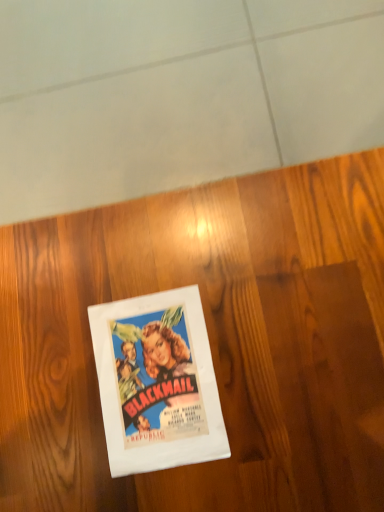
Where is `wooden at center`? wooden at center is located at coordinates (209, 340).

Describe the element at coordinates (209, 340) in the screenshot. I see `wooden at center` at that location.

This screenshot has height=512, width=384. What do you see at coordinates (157, 382) in the screenshot?
I see `white paper at center` at bounding box center [157, 382].

Identify the location of white paper at center. click(x=157, y=382).

I want to click on wooden at center, so click(x=209, y=340).

Which is more to the right, wooden at center or white paper at center?

Positioned to the right is wooden at center.

Which object is closer to the camera taking this photo, wooden at center or white paper at center?

wooden at center.

Which is behind, point (10, 501) or point (154, 455)?

Positioned behind is point (10, 501).

From the image's perspective, is wooden at center positioned above or below white paper at center?

Based on their image positions, wooden at center is located above white paper at center.

From a real-world perspective, which is physically above, wooden at center or white paper at center?

In real-world perspective, white paper at center is above.

Which of these two, wooden at center or white paper at center, is thinner?

white paper at center.

In terms of height, does wooden at center look taller or shorter compared to white paper at center?

wooden at center is taller than white paper at center.

Looking at the image, does wooden at center seem bigger or smaller compared to white paper at center?

Clearly, wooden at center is larger in size than white paper at center.

Is wooden at center inside or outside of white paper at center?

wooden at center cannot be found inside white paper at center.

Is wooden at center not close to white paper at center?

No.

Is wooden at center facing towards white paper at center?

No, wooden at center is not aimed at white paper at center.

What's the angular difference between wooden at center and white paper at center's facing directions?

The facing directions of wooden at center and white paper at center are 92.1 degrees apart.

Measure the distance between wooden at center and white paper at center.

wooden at center and white paper at center are 4.17 inches apart from each other.

What are the coordinates of `picture frame below the wooden at center (from the image's perspective)` in the screenshot? It's located at (157, 382).

Is white paper at center to the left of wooden at center from the viewer's perspective?

Yes, white paper at center is to the left of wooden at center.

Does white paper at center come behind wooden at center?

Yes.

Is point (100, 350) positioned after point (15, 303)?

No, (100, 350) is closer to viewer.

From the image's perspective, between white paper at center and wooden at center, who is located below?

white paper at center, from the image's perspective.

From a real-world perspective, is white paper at center under wooden at center?

Incorrect, from a real-world perspective, white paper at center is higher than wooden at center.

Is white paper at center wider or thinner than wooden at center?

Considering their sizes, white paper at center looks slimmer than wooden at center.

Considering the relative sizes of white paper at center and wooden at center in the image provided, is white paper at center shorter than wooden at center?

Indeed, white paper at center has a lesser height compared to wooden at center.

Which of these two, white paper at center or wooden at center, is smaller?

Smaller between the two is white paper at center.

Is wooden at center located within white paper at center?

Definitely not — wooden at center is not inside white paper at center.

Is white paper at center far from wooden at center?

No.

Could you tell me if white paper at center is turned towards wooden at center?

Yes.

How distant is white paper at center from wooden at center?

white paper at center is 4.17 inches from wooden at center.

At what (x,y) coordinates should I click in order to perform the action: click on plywood located on the right of white paper at center. Please return your answer as a coordinate pair (x, y). Looking at the image, I should click on (209, 340).

Where is `plywood that appears above the white paper at center (from the image's perspective)`? This screenshot has width=384, height=512. plywood that appears above the white paper at center (from the image's perspective) is located at coordinates pyautogui.click(x=209, y=340).

The image size is (384, 512). In order to click on picture frame above the wooden at center (from a real-world perspective) in this screenshot , I will do `click(157, 382)`.